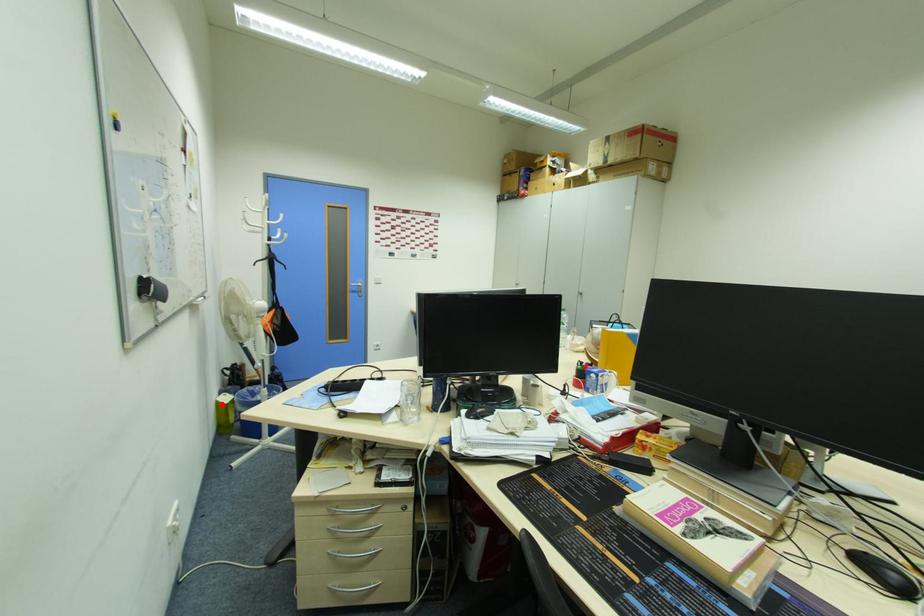
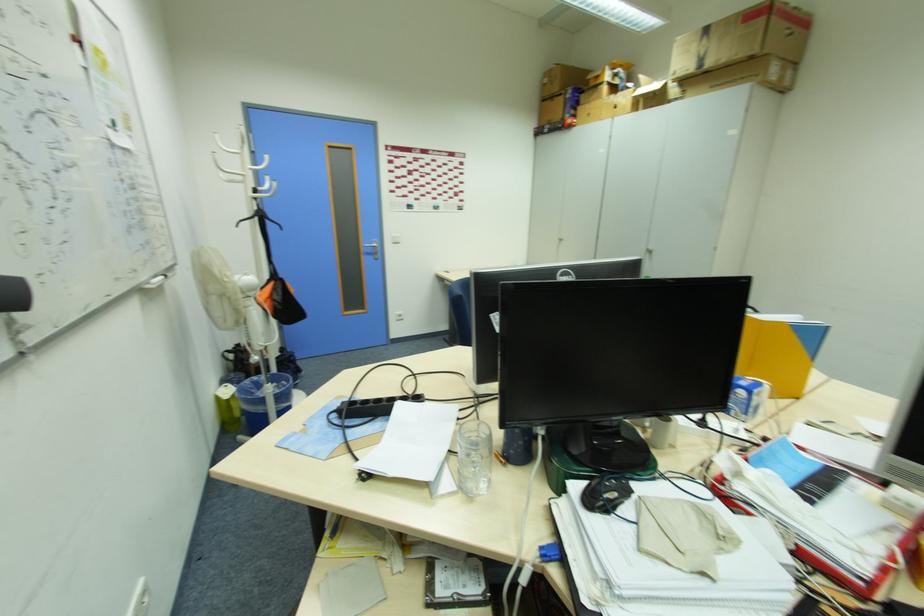
The point at the highlighted location is marked in the first image. Where is the corresponding point in the second image?

(220, 400)